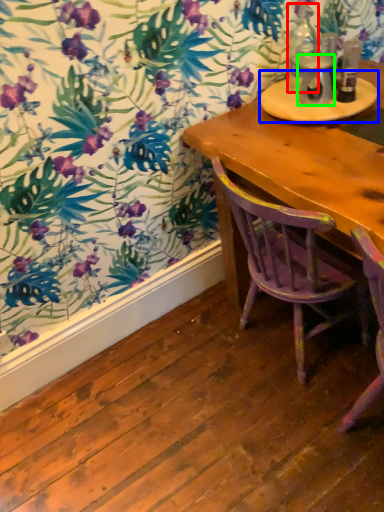
Question: Estimate the real-world distances between objects in this image. Which object is farther from bottle (highlighted by a red box), round table (highlighted by a blue box) or beverage (highlighted by a green box)?

Choices:
 (A) round table
 (B) beverage

Answer: (A)